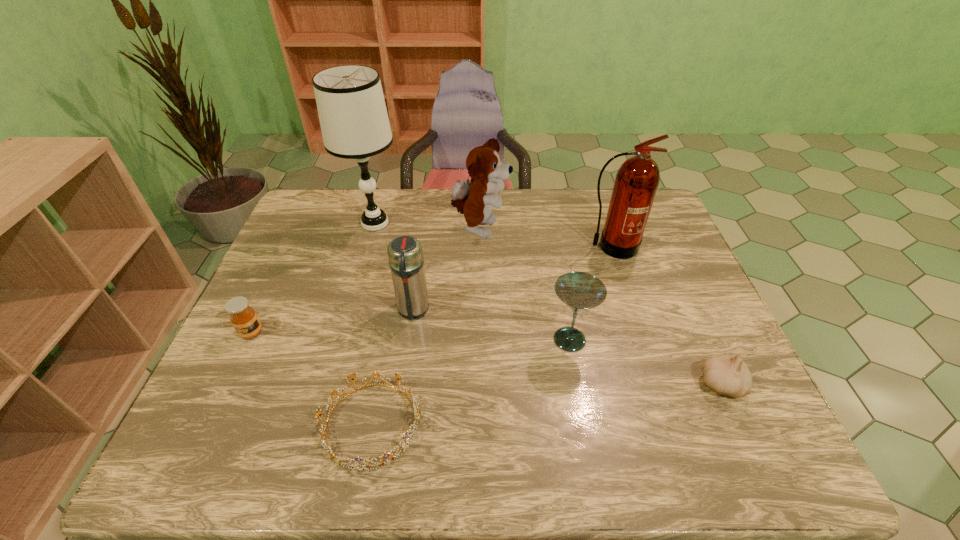
Locate an element on the screen. The image size is (960, 540). the tallest object is located at coordinates (354, 122).

Identify the location of fire extinguisher. (637, 180).

The image size is (960, 540). What are the coordinates of `the second object from right to left` in the screenshot? It's located at (637, 180).

Identify the location of the fourth object from right to left. This screenshot has width=960, height=540. (475, 198).

At what (x,y) coordinates should I click in order to perform the action: click on the sixth shortest object. Please return your answer as a coordinate pair (x, y). The width and height of the screenshot is (960, 540). Looking at the image, I should click on [x=475, y=198].

The width and height of the screenshot is (960, 540). What are the coordinates of `the fourth tallest object` in the screenshot? It's located at (405, 254).

Locate an element on the screen. martini is located at coordinates (580, 291).

Find the location of a particular element. This screenshot has width=960, height=540. the third object from right to left is located at coordinates (580, 291).

Identify the location of the leftmost object. The height and width of the screenshot is (540, 960). (244, 319).

Image resolution: width=960 pixels, height=540 pixels. In order to click on the rightmost object in this screenshot , I will do `click(725, 374)`.